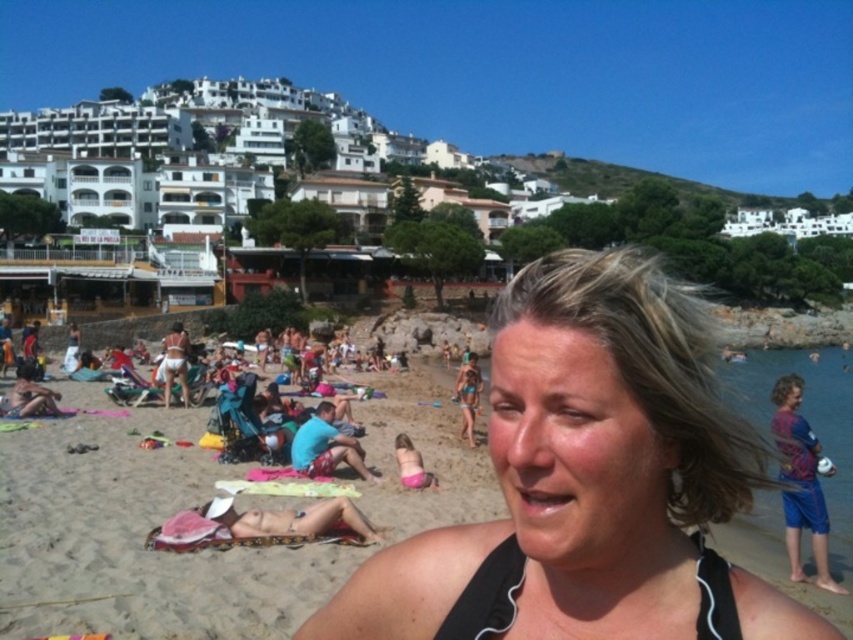
Which of these two, black fabric bikini top at lower center or blue fabric shorts at right, stands taller?

Standing taller between the two is blue fabric shorts at right.

Locate an element on the screen. Image resolution: width=853 pixels, height=640 pixels. black fabric bikini top at lower center is located at coordinates (486, 596).

Does black swimsuit at center have a greater height compared to blue fabric shorts at right?

Indeed, black swimsuit at center has a greater height compared to blue fabric shorts at right.

Does black swimsuit at center lie in front of blue fabric shorts at right?

Yes, it is.

The height and width of the screenshot is (640, 853). I want to click on black swimsuit at center, so click(x=589, y=481).

Which is in front, point (335, 624) or point (701, 580)?

Point (701, 580) is more forward.

Which is above, black swimsuit at center or black fabric bikini top at lower center?

black swimsuit at center is higher up.

Is point (610, 608) closer to camera compared to point (697, 627)?

No.

I want to click on black swimsuit at center, so click(x=589, y=481).